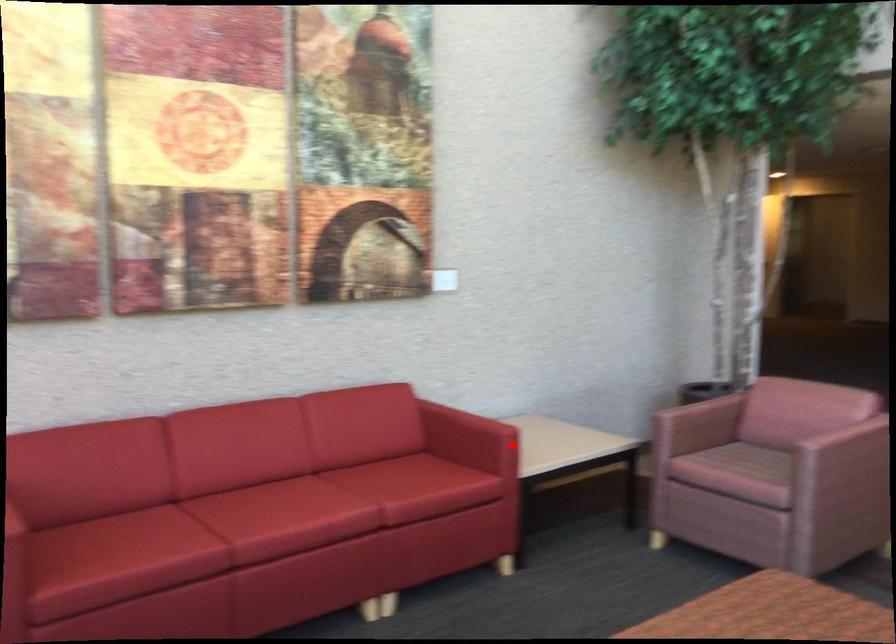
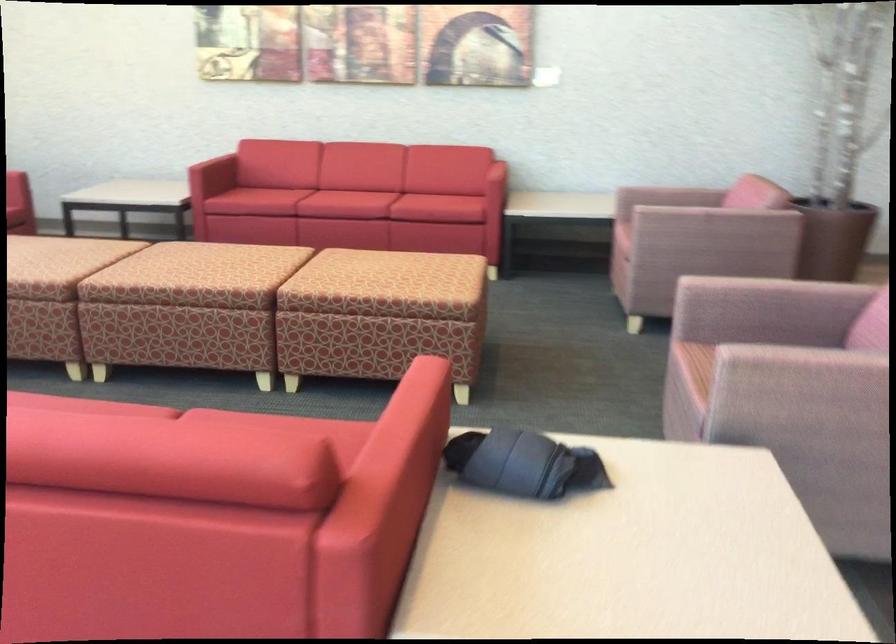
In the second image, find the point that corresponds to the highlighted location in the first image.

(490, 173)